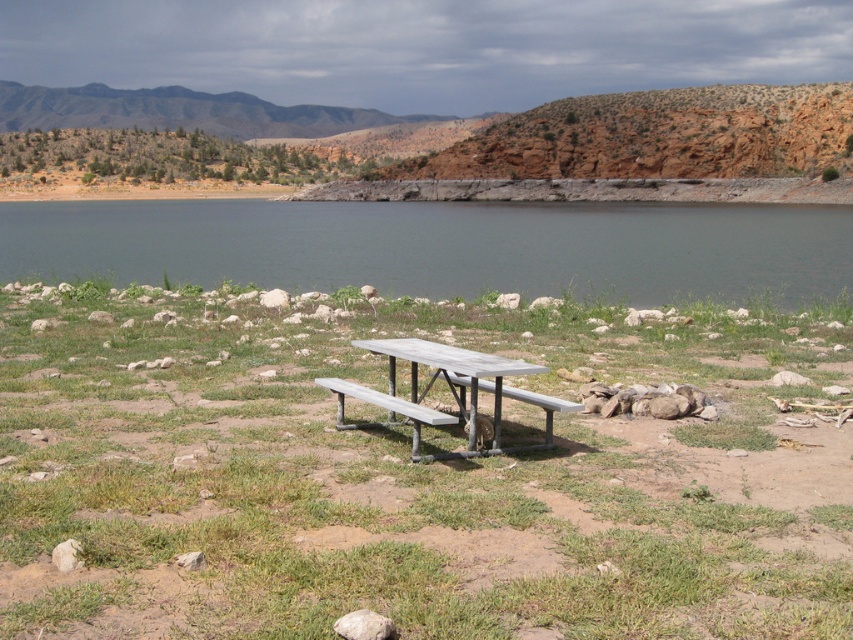
Question: From the image, what is the correct spatial relationship of green grass at center in relation to clear water at lake center?

Choices:
 (A) right
 (B) left

Answer: (B)

Question: Which of the following is the closest to the observer?

Choices:
 (A) (494, 438)
 (B) (340, 257)
 (C) (164, 388)

Answer: (A)

Question: Which of the following is the closest to the observer?

Choices:
 (A) (213, 426)
 (B) (173, 241)

Answer: (A)

Question: Is gray metallic bench at center thinner than metallic silver park bench at center?

Choices:
 (A) yes
 (B) no

Answer: (B)

Question: Is the position of clear water at lake center more distant than that of metallic silver park bench at center?

Choices:
 (A) no
 (B) yes

Answer: (B)

Question: Among these objects, which one is nearest to the camera?

Choices:
 (A) green grass at center
 (B) gray metallic bench at center
 (C) wooden picnic table at center

Answer: (A)